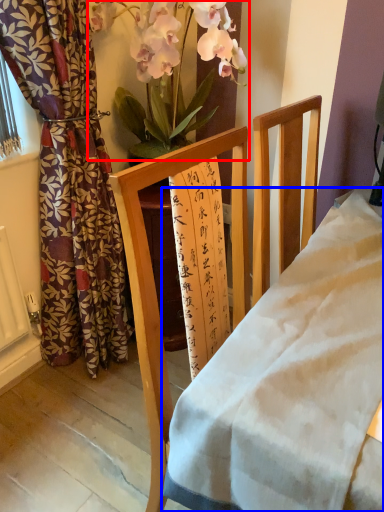
Question: Which object is closer to the camera taking this photo, floral arrangement (highlighted by a red box) or desk (highlighted by a blue box)?

Choices:
 (A) floral arrangement
 (B) desk

Answer: (B)